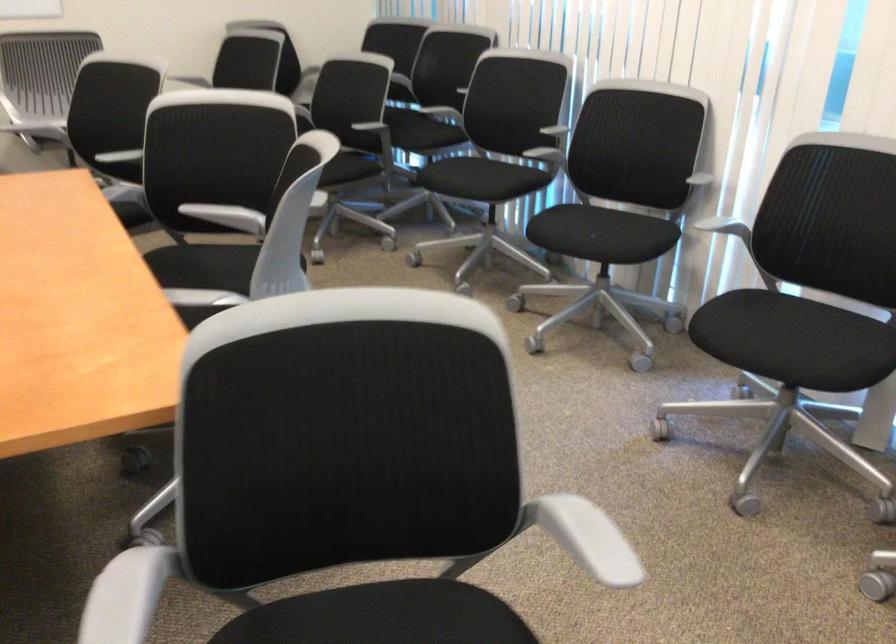
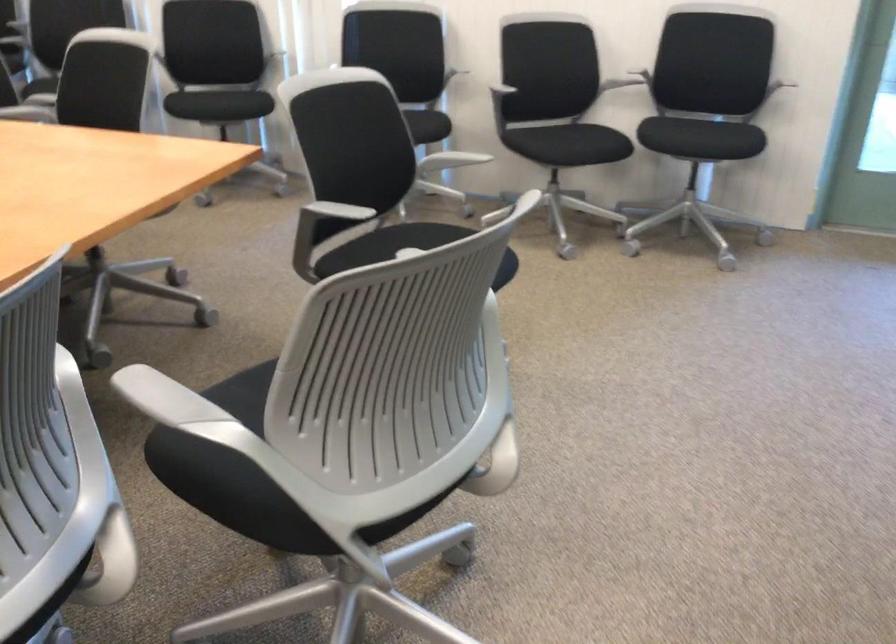
In the second image, find the point that corresponds to point 613,247 in the first image.

(238, 102)